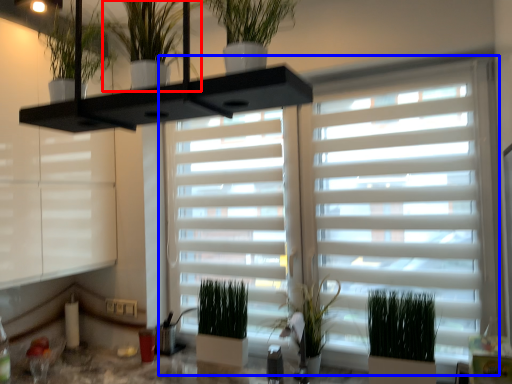
Question: Which object is closer to the camera taking this photo, houseplant (highlighted by a red box) or window blind (highlighted by a blue box)?

Choices:
 (A) houseplant
 (B) window blind

Answer: (A)